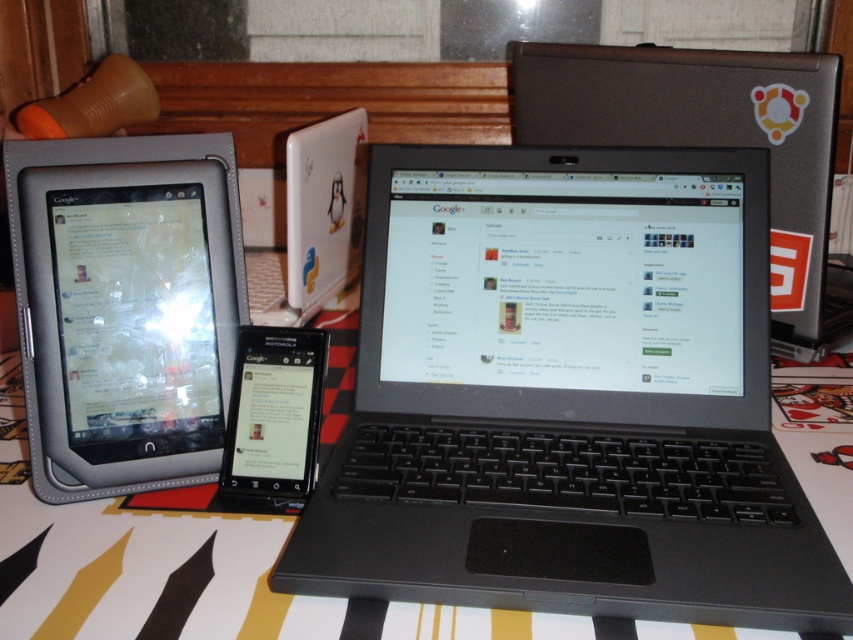
Question: Estimate the real-world distances between objects in this image. Which object is closer to the leather-like tablet at left?

Choices:
 (A) black glossy tablet at center
 (B) black plastic laptop at center

Answer: (A)

Question: Estimate the real-world distances between objects in this image. Which object is closer to the black plastic laptop at center?

Choices:
 (A) leather-like tablet at left
 (B) black glossy tablet at center

Answer: (B)

Question: Does leather-like tablet at left have a greater width compared to black glossy tablet at center?

Choices:
 (A) no
 (B) yes

Answer: (B)

Question: Based on their relative distances, which object is nearer to the black glossy tablet at center?

Choices:
 (A) leather-like tablet at left
 (B) black plastic laptop at center

Answer: (A)

Question: Is leather-like tablet at left behind black glossy tablet at center?

Choices:
 (A) yes
 (B) no

Answer: (A)

Question: Can you confirm if black plastic laptop at center is bigger than leather-like tablet at left?

Choices:
 (A) yes
 (B) no

Answer: (A)